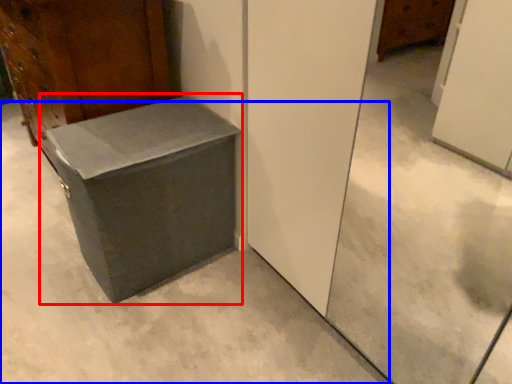
Question: Which of the following is the farthest to the observer, cardboard box (highlighted by a red box) or concrete (highlighted by a blue box)?

Choices:
 (A) cardboard box
 (B) concrete

Answer: (A)